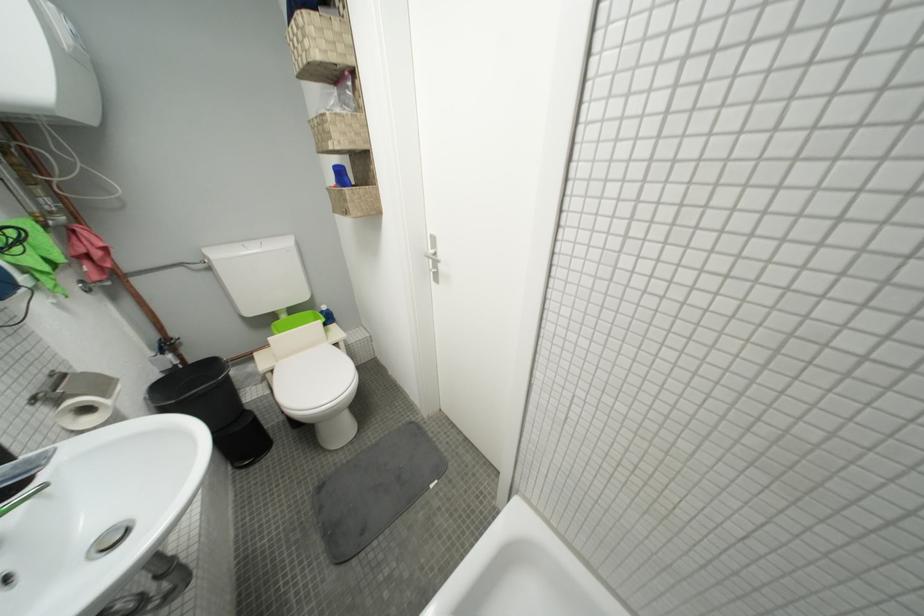
Where is `toilet flush button`? This screenshot has height=616, width=924. toilet flush button is located at coordinates pos(252,251).